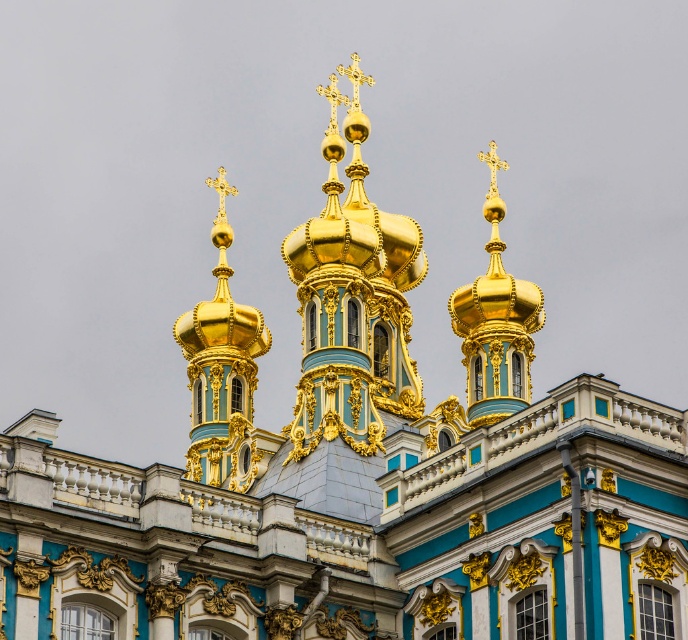
Question: Is gold polished dome at upper left closer to the viewer compared to gold polished dome at upper center?

Choices:
 (A) yes
 (B) no

Answer: (A)

Question: In this image, where is gold polished dome at upper left located relative to gold polished dome at upper center?

Choices:
 (A) left
 (B) right

Answer: (A)

Question: Can you confirm if gold polished dome at upper left is positioned to the left of gold polished dome at upper center?

Choices:
 (A) yes
 (B) no

Answer: (A)

Question: Which object appears closest to the camera in this image?

Choices:
 (A) gold polished dome at upper center
 (B) gold polished dome at upper left

Answer: (B)